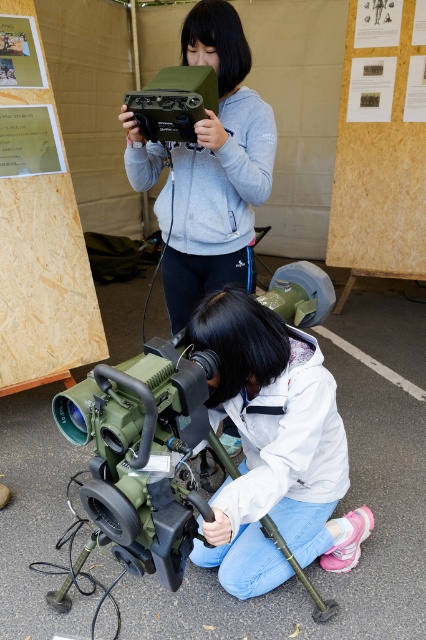
Question: Which of the following is the closest to the observer?

Choices:
 (A) (245, 288)
 (B) (317, 512)
 (C) (40, 99)
 (D) (176, 93)

Answer: (B)

Question: Does white matte jacket at lower center appear on the left side of matte green device at upper center?

Choices:
 (A) no
 (B) yes

Answer: (A)

Question: Which of the following is the closest to the observer?

Choices:
 (A) wooden board at upper left
 (B) matte green device at upper center

Answer: (B)

Question: Is wooden board at upper left smaller than matte green plastic video camera at upper center?

Choices:
 (A) yes
 (B) no

Answer: (B)

Question: Does white matte jacket at lower center appear on the right side of matte green plastic video camera at upper center?

Choices:
 (A) no
 (B) yes

Answer: (B)

Question: Which point appears closest to the camera in this image?

Choices:
 (A) (187, 209)
 (B) (25, 257)

Answer: (A)